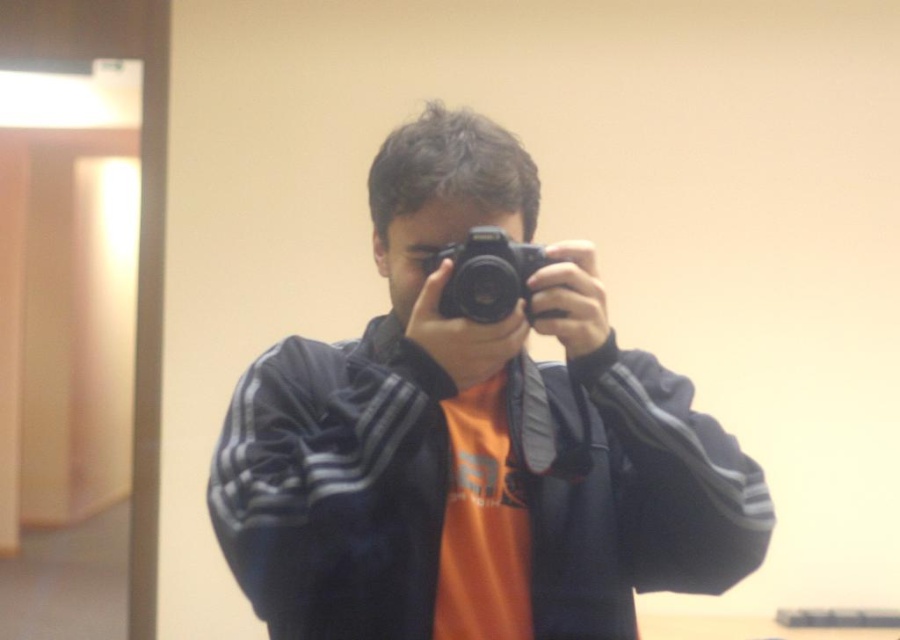
You are trying to decide which camera to use for a photography session. You notice both the black matte camera at center and the black plastic camera at center in the scene. Based on their positions, which one is closer to the person taking the photo?

The black matte camera at center is positioned under the black plastic camera at center, so the black plastic camera at center is closer to the person taking the photo.

You are a photographer trying to choose between two cameras in the center of the scene. The black matte camera at center and the black plastic camera at center. Which one is larger?

The black matte camera at center is bigger than the black plastic camera at center.

You are a photographer trying to choose between two cameras in the center of the scene. The black matte camera at center and the black plastic camera at center. Which one is taller?

The black matte camera at center is taller than the black plastic camera at center.